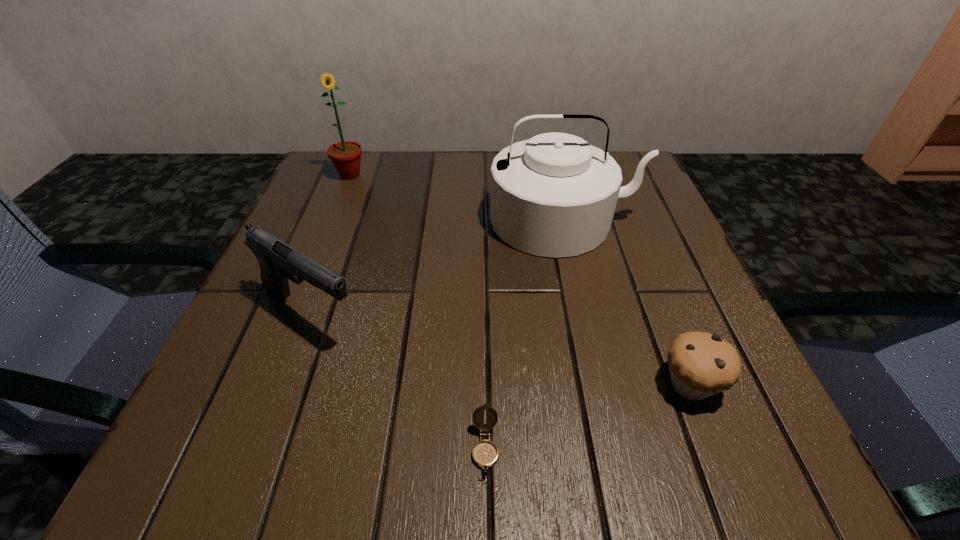
Identify the location of free location that satisfies the following two spatial constraints: 1. at the muzzle of the gun; 2. on the left side of the second shortest object. The image size is (960, 540). (284, 384).